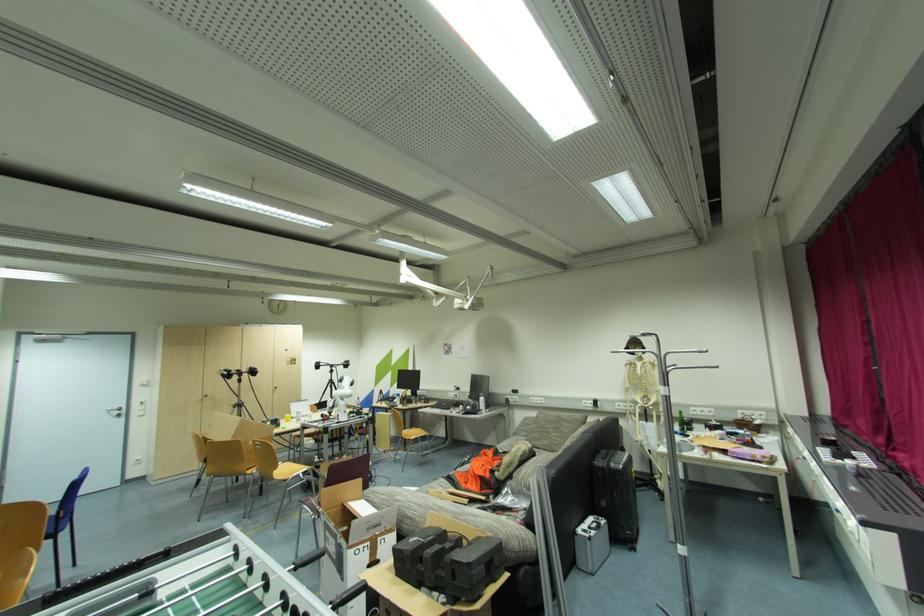
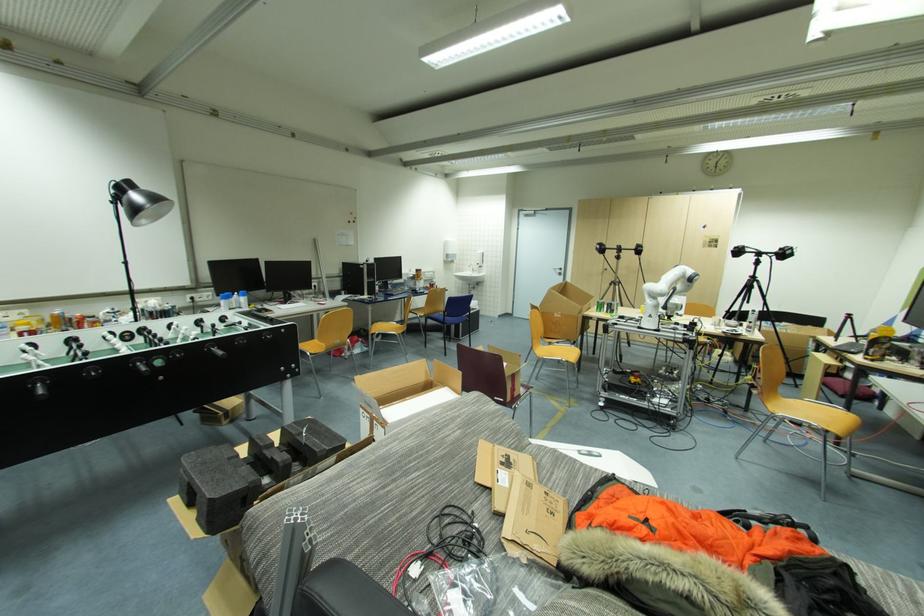
Find the pixel in the second image that matches pixel 371 531 in the first image.

(369, 403)